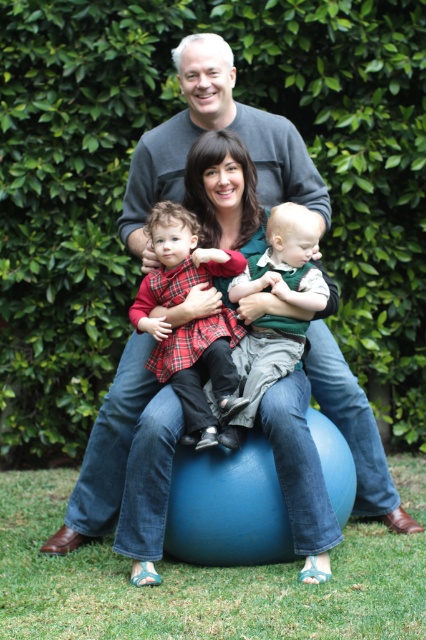
Looking at this image, what is the 2D coordinate of the green leafy hedge at upper center in the image?

The green leafy hedge at upper center is located at the 2D coordinate point of (126, 176).

You are a photographer setting up for a family photo. You notice the green leafy hedge at upper center and the plaid fabric dress at center. Which object should you adjust your camera focus to ensure both are in frame without moving the family? Explain your reasoning.

The green leafy hedge at upper center might be wider than plaid fabric dress at center, so adjusting the camera focus to accommodate the wider hedge would ensure both are in frame without moving the family.

You are a photographer setting up for a family photo. You notice the green leafy hedge at upper center and the green cotton shirt at center. Which object should you adjust your camera focus to ensure the larger one is in sharp focus?

The green leafy hedge at upper center is larger than the green cotton shirt at center, so you should focus on the green leafy hedge at upper center to ensure the larger object is in sharp focus.